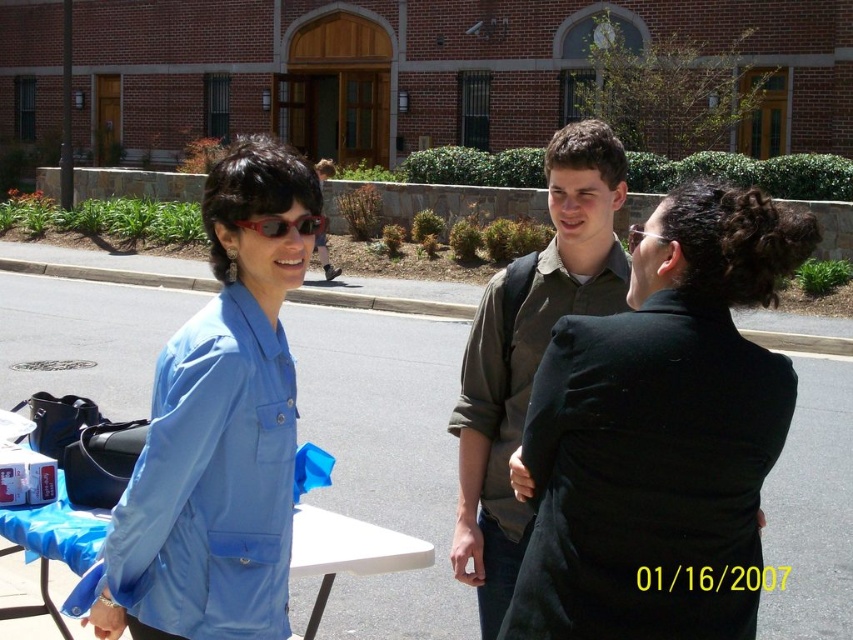
You are a delivery person holding a package that requires a signature. You see the matte blue shirt at left and the blue fabric picnic table at lower left. Which object should you approach to find the person who can sign for the package?

The matte blue shirt at left is closer to you than the blue fabric picnic table at lower left, so you should approach the matte blue shirt at left to find the person who can sign for the package.

You are standing in front of the brick building and want to walk towards the two points marked in the scene. Which point, point (225, 285) or point (339, 566), will you reach first?

Point (225, 285) is closer to the viewer than point (339, 566), so you will reach point (225, 285) first.

You are a photographer standing in front of the brick building. You want to take a photo of the matte blue shirt at left and the matte green shirt at center. Which person is positioned higher in the frame?

The matte blue shirt at left is located above the matte green shirt at center, so the person wearing the matte blue shirt at left is positioned higher in the frame.